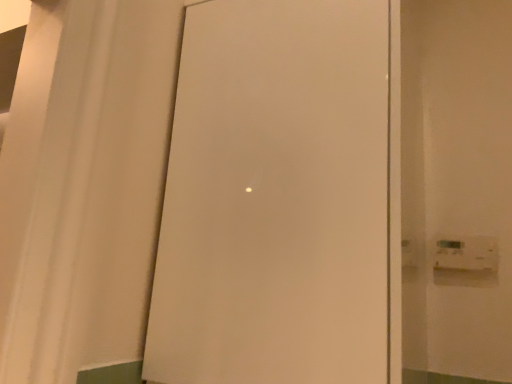
Question: Is white plastic light switch at right placed right next to white matte door at center?

Choices:
 (A) yes
 (B) no

Answer: (B)

Question: Can you confirm if white plastic light switch at right is smaller than white matte door at center?

Choices:
 (A) yes
 (B) no

Answer: (A)

Question: Does white plastic light switch at right turn towards white matte door at center?

Choices:
 (A) yes
 (B) no

Answer: (B)

Question: Does white plastic light switch at right appear on the right side of white matte door at center?

Choices:
 (A) no
 (B) yes

Answer: (B)

Question: From the image's perspective, does white plastic light switch at right appear lower than white matte door at center?

Choices:
 (A) no
 (B) yes

Answer: (B)

Question: Does white plastic light switch at right appear on the left side of white matte door at center?

Choices:
 (A) no
 (B) yes

Answer: (A)

Question: Are white matte door at center and white plastic light switch at right making contact?

Choices:
 (A) no
 (B) yes

Answer: (A)

Question: Is white matte door at center smaller than white plastic light switch at right?

Choices:
 (A) no
 (B) yes

Answer: (A)

Question: Does white matte door at center turn towards white plastic light switch at right?

Choices:
 (A) no
 (B) yes

Answer: (A)

Question: Is white matte door at center at the left side of white plastic light switch at right?

Choices:
 (A) no
 (B) yes

Answer: (B)

Question: Is white matte door at center looking in the opposite direction of white plastic light switch at right?

Choices:
 (A) no
 (B) yes

Answer: (A)

Question: Is white matte door at center not within white plastic light switch at right?

Choices:
 (A) yes
 (B) no

Answer: (A)

Question: From a real-world perspective, is white matte door at center positioned above or below white plastic light switch at right?

Choices:
 (A) below
 (B) above

Answer: (B)